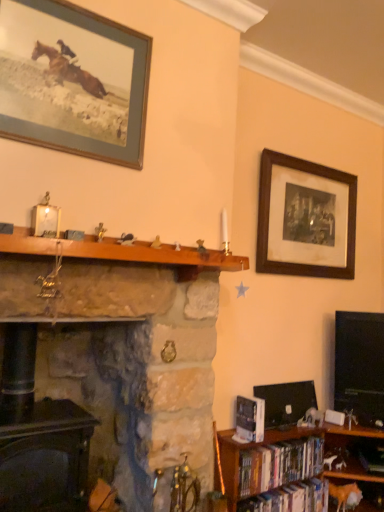
Question: Can you confirm if hardcover books at lower right, which is the 2th book from bottom to top, is bigger than black glossy flat-screen tv at right?

Choices:
 (A) no
 (B) yes

Answer: (A)

Question: Is hardcover books at lower right, which is the 2th book from bottom to top, positioned beyond the bounds of black glossy flat-screen tv at right?

Choices:
 (A) no
 (B) yes

Answer: (B)

Question: From a real-world perspective, is hardcover books at lower right, which is the 2th book from bottom to top, beneath black glossy flat-screen tv at right?

Choices:
 (A) no
 (B) yes

Answer: (B)

Question: Can you confirm if hardcover books at lower right, the 2th book viewed from the top, is thinner than black glossy flat-screen tv at right?

Choices:
 (A) no
 (B) yes

Answer: (B)

Question: Could you tell me if hardcover books at lower right, which is the 2th book from bottom to top, is facing black glossy flat-screen tv at right?

Choices:
 (A) yes
 (B) no

Answer: (B)

Question: Is black glossy flat-screen tv at right inside hardcover books at lower right, which is the 2th book from bottom to top?

Choices:
 (A) yes
 (B) no

Answer: (B)

Question: Would you say dark wood fireplace at lower left, acting as the first fireplace starting from the left, is outside natural stone fireplace at center, the 1th fireplace positioned from the right?

Choices:
 (A) yes
 (B) no

Answer: (B)

Question: Does dark wood fireplace at lower left, positioned as the second fireplace in right-to-left order, have a larger size compared to natural stone fireplace at center, the 1th fireplace positioned from the right?

Choices:
 (A) no
 (B) yes

Answer: (A)

Question: Does dark wood fireplace at lower left, acting as the first fireplace starting from the left, have a smaller size compared to natural stone fireplace at center, the 1th fireplace positioned from the right?

Choices:
 (A) yes
 (B) no

Answer: (A)

Question: Considering the relative positions of dark wood fireplace at lower left, acting as the first fireplace starting from the left, and natural stone fireplace at center, the 1th fireplace positioned from the right, in the image provided, is dark wood fireplace at lower left, acting as the first fireplace starting from the left, to the right of natural stone fireplace at center, the 1th fireplace positioned from the right, from the viewer's perspective?

Choices:
 (A) yes
 (B) no

Answer: (B)

Question: Would you say dark wood fireplace at lower left, acting as the first fireplace starting from the left, contains natural stone fireplace at center, the 1th fireplace positioned from the right?

Choices:
 (A) no
 (B) yes

Answer: (A)

Question: Does dark wood fireplace at lower left, acting as the first fireplace starting from the left, have a greater width compared to natural stone fireplace at center, the 1th fireplace positioned from the right?

Choices:
 (A) no
 (B) yes

Answer: (A)

Question: From a real-world perspective, is dark wood fireplace at lower left, acting as the first fireplace starting from the left, positioned over black glossy flat-screen tv at right based on gravity?

Choices:
 (A) yes
 (B) no

Answer: (B)